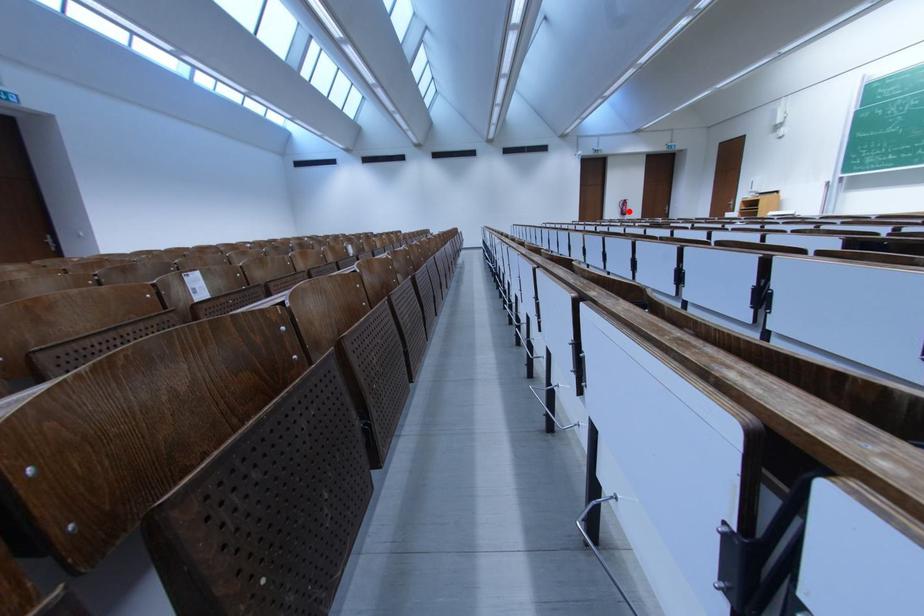
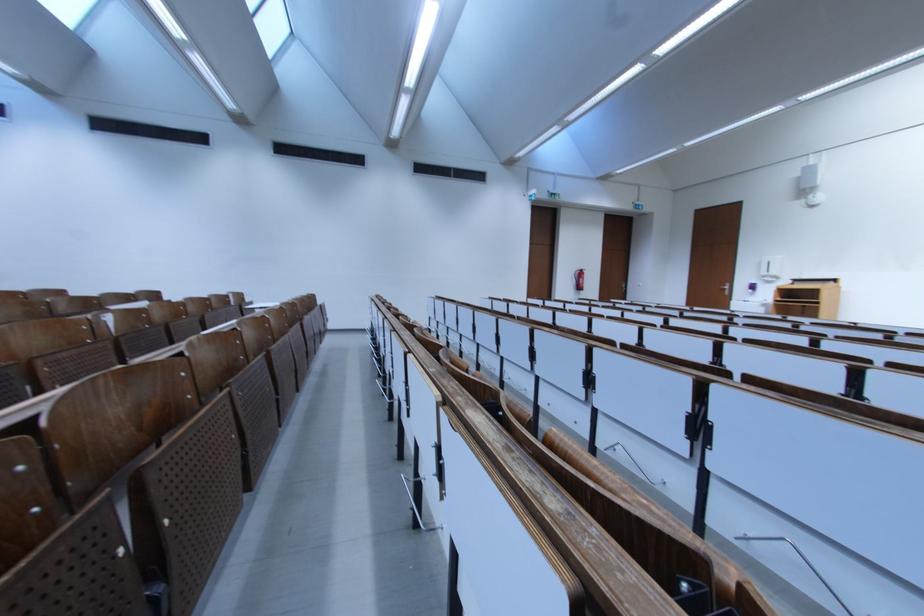
In the second image, find the point that corresponds to the highlighted location in the first image.

(584, 284)